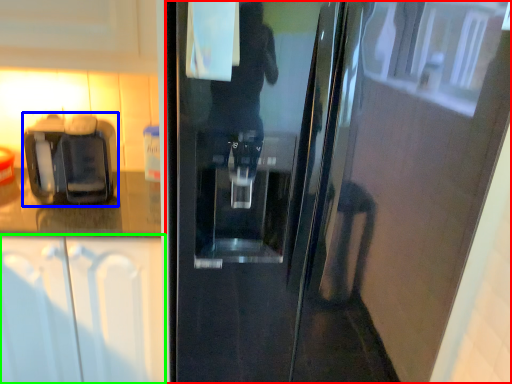
Question: Based on their relative distances, which object is farther from door (highlighted by a red box)? Choose from coffee machine (highlighted by a blue box) and cabinetry (highlighted by a green box).

Choices:
 (A) coffee machine
 (B) cabinetry

Answer: (A)